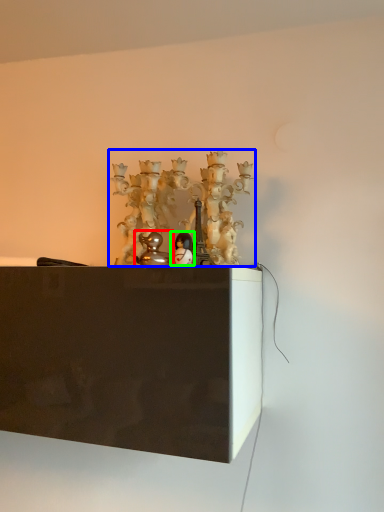
Question: Which object is positioned farthest from toy (highlighted by a red box)? Select from art (highlighted by a blue box) and toy (highlighted by a green box).

Choices:
 (A) art
 (B) toy

Answer: (A)